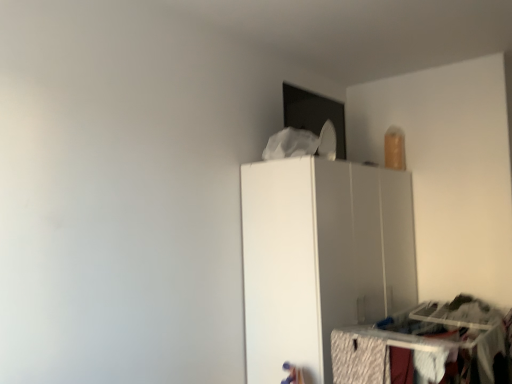
In order to face white glossy cabinet at center, should I rotate leftwards or rightwards?

To face it directly, rotate right by 11.764 degrees.

What do you see at coordinates (321, 258) in the screenshot? I see `white glossy cabinet at center` at bounding box center [321, 258].

This screenshot has width=512, height=384. What are the coordinates of `white glossy cabinet at center` in the screenshot? It's located at (321, 258).

This screenshot has height=384, width=512. I want to click on white glossy cabinet at center, so click(x=321, y=258).